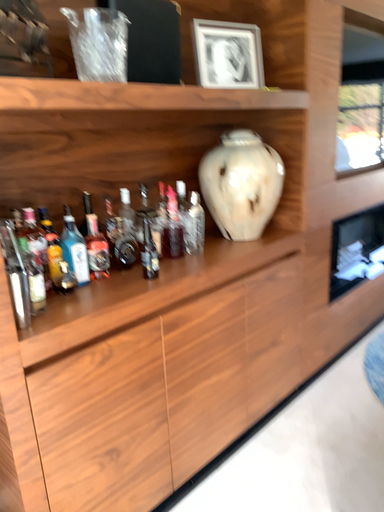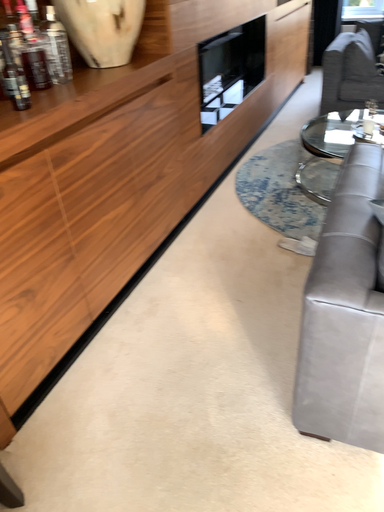
Question: How did the camera likely rotate when shooting the video?

Choices:
 (A) rotated left
 (B) rotated right

Answer: (B)